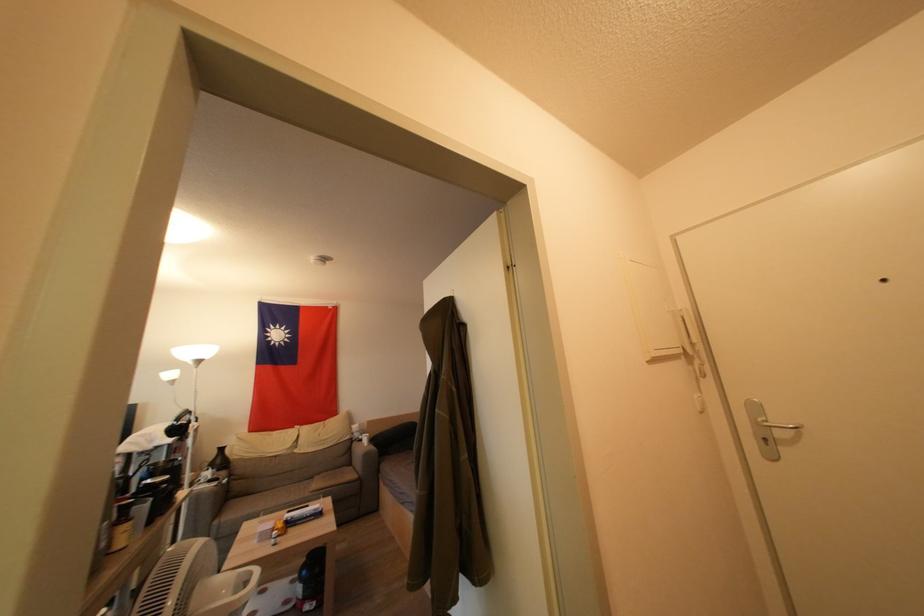
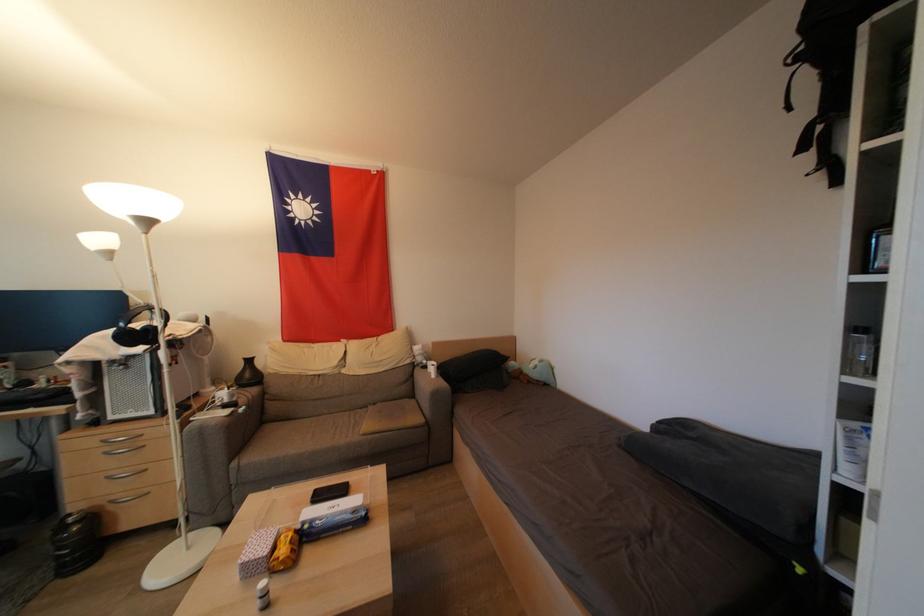
Where in the second image is the point corresponding to (x=378, y=444) from the first image?

(445, 373)